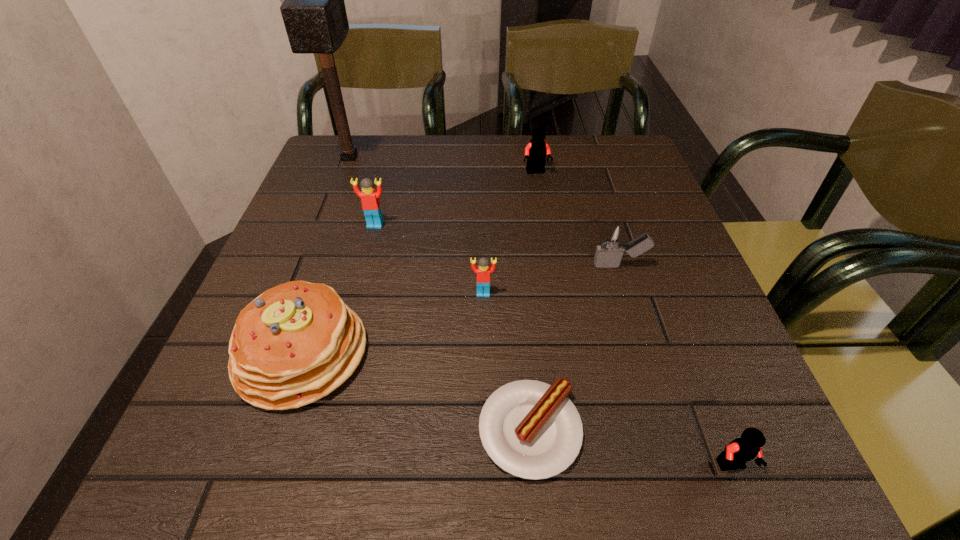
This screenshot has height=540, width=960. I want to click on the smaller black Lego, so click(x=740, y=450).

In order to click on the right black Lego in this screenshot , I will do `click(740, 450)`.

Image resolution: width=960 pixels, height=540 pixels. I want to click on the shortest object, so click(x=530, y=429).

Where is `vacant space located 0.050m on the front of the mallet`? The image size is (960, 540). vacant space located 0.050m on the front of the mallet is located at coordinates (339, 186).

This screenshot has height=540, width=960. I want to click on free region located on the face of the sixth nearest object, so click(361, 281).

This screenshot has height=540, width=960. In order to click on vacant space located 0.360m on the front-facing side of the second Lego from right to left in this screenshot , I will do `click(553, 280)`.

Identify the location of free spot located on the back of the igniter. This screenshot has height=540, width=960. (606, 222).

I want to click on vacant space located 0.070m on the front of the pancake, so click(x=266, y=460).

The height and width of the screenshot is (540, 960). I want to click on vacant region located on the face of the smaller red Lego, so click(484, 428).

Where is `blank area located on the back of the sausage`? The height and width of the screenshot is (540, 960). blank area located on the back of the sausage is located at coordinates (515, 244).